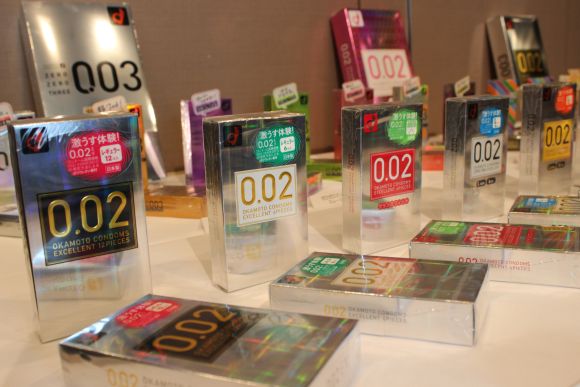
Identify the location of table top. (394, 368).